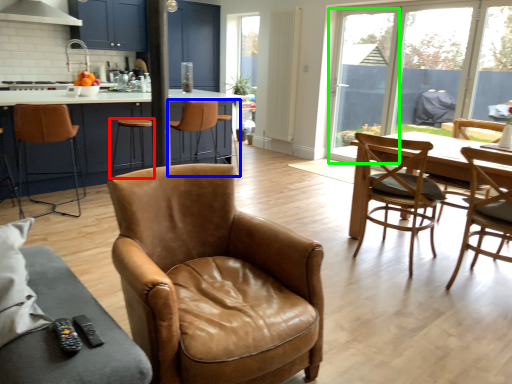
Question: Considering the real-world distances, which object is closest to stool (highlighted by a red box)? chair (highlighted by a blue box) or window screen (highlighted by a green box).

Choices:
 (A) chair
 (B) window screen

Answer: (A)